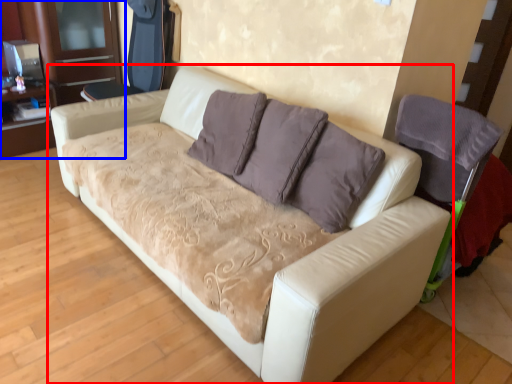
Question: Which object appears closest to the camera in this image, studio couch (highlighted by a red box) or dresser (highlighted by a blue box)?

Choices:
 (A) studio couch
 (B) dresser

Answer: (A)